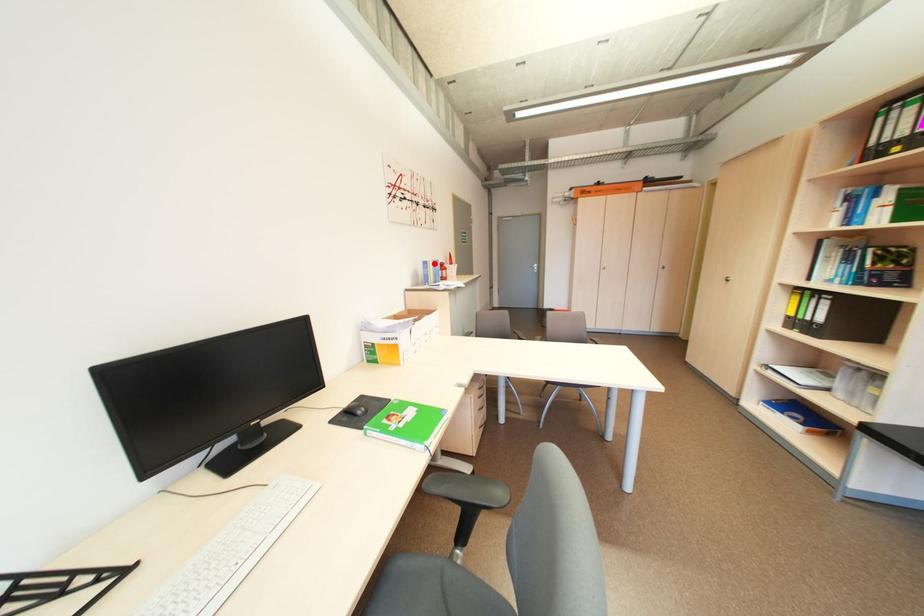
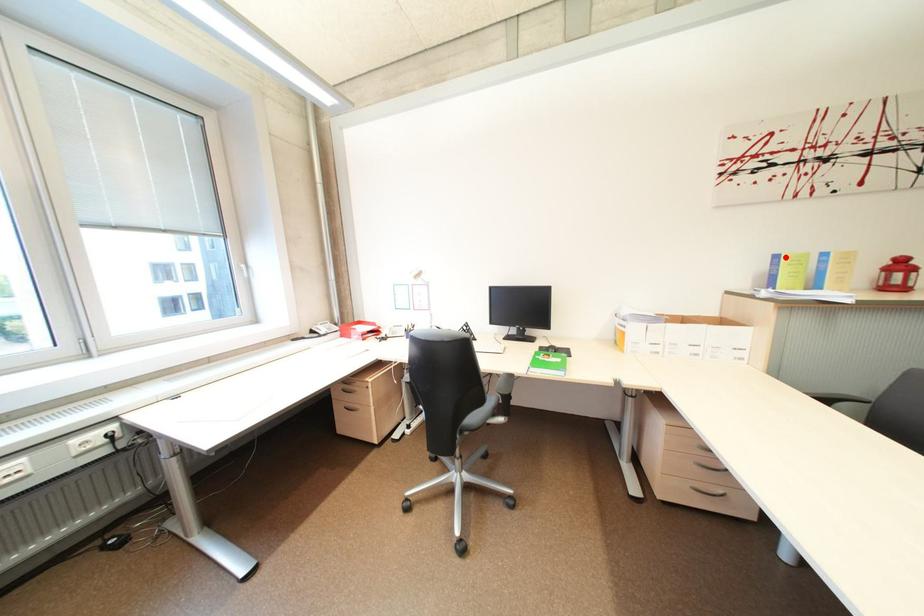
Looking at this image, I am providing you with two images of the same scene from different viewpoints. A red point is marked on the first image and another point is marked on the second image. Is the red point in image1 aligned with the point shown in image2?

Yes